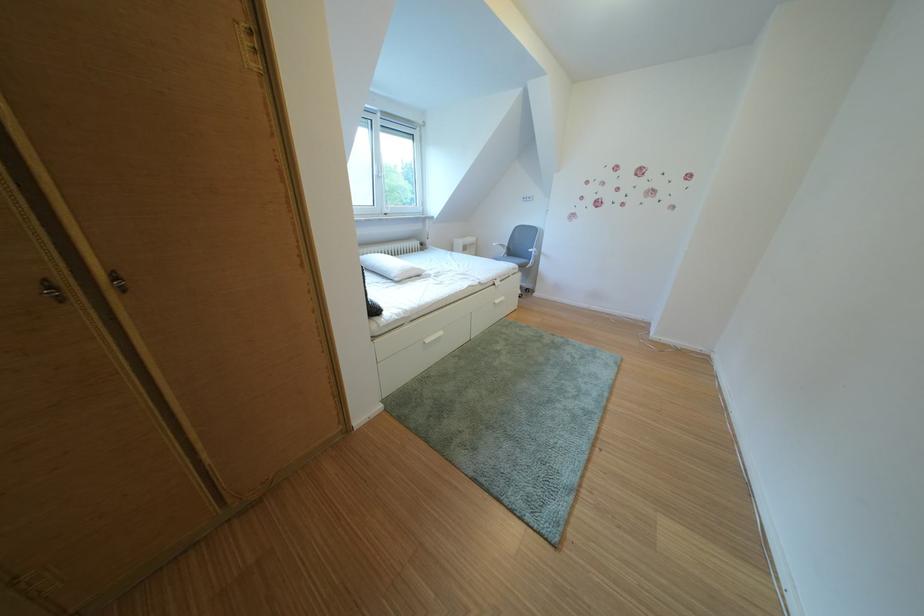
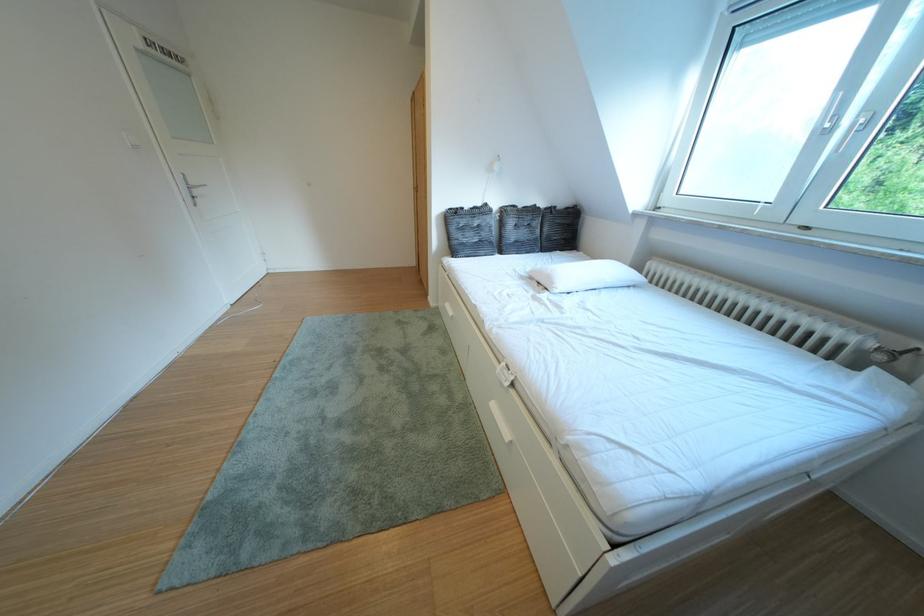
Where in the second image is the point corresponding to [433,275] from the first image?

(565, 288)